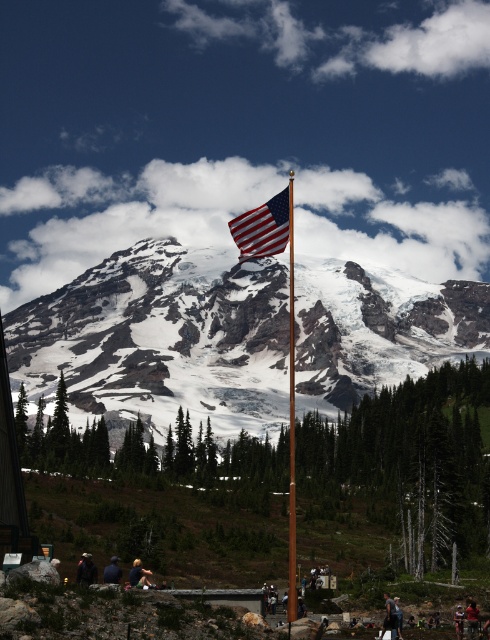
Question: Which of the following is the farthest from the observer?

Choices:
 (A) dark blue jacket at lower left
 (B) light brown leather jacket at lower center

Answer: (B)

Question: Which point is farther to the camera?

Choices:
 (A) dark blue fabric at lower center
 (B) polished wood flag pole at center
 (C) dark blue jacket at lower left
 (D) snowy granite mountain at center

Answer: (D)

Question: Can you confirm if polished wood flag pole at center is bigger than red shirt at center?

Choices:
 (A) yes
 (B) no

Answer: (A)

Question: Which object is closer to the camera taking this photo?

Choices:
 (A) dark blue jeans at lower right
 (B) dark blue fabric at lower center
 (C) dark blue jacket at lower left

Answer: (A)

Question: Does red shirt at center have a smaller size compared to blue fabric shirt at center?

Choices:
 (A) no
 (B) yes

Answer: (A)

Question: Can you confirm if light brown leather jacket at lower center is positioned to the left of dark blue fabric at lower center?

Choices:
 (A) no
 (B) yes

Answer: (A)